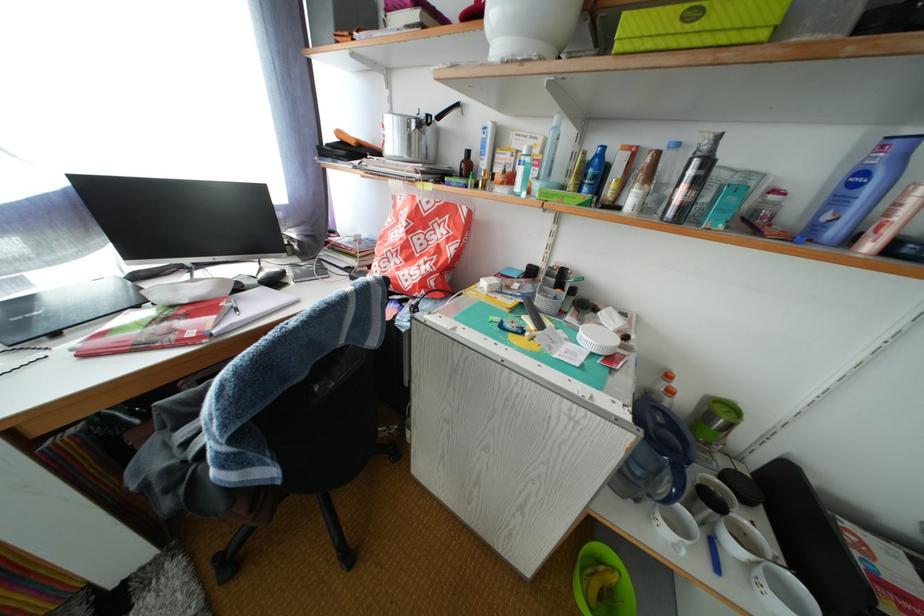
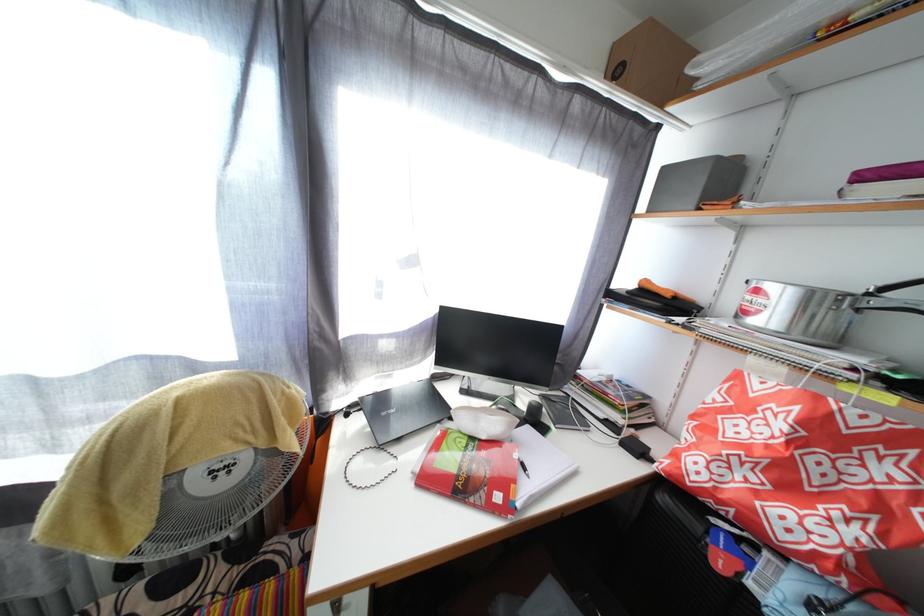
Question: The camera is either moving clockwise (left) or counter-clockwise (right) around the object. The first image is from the beginning of the video and the second image is from the end. Is the camera moving left or right when shooting the video?

Choices:
 (A) Left
 (B) Right

Answer: (B)